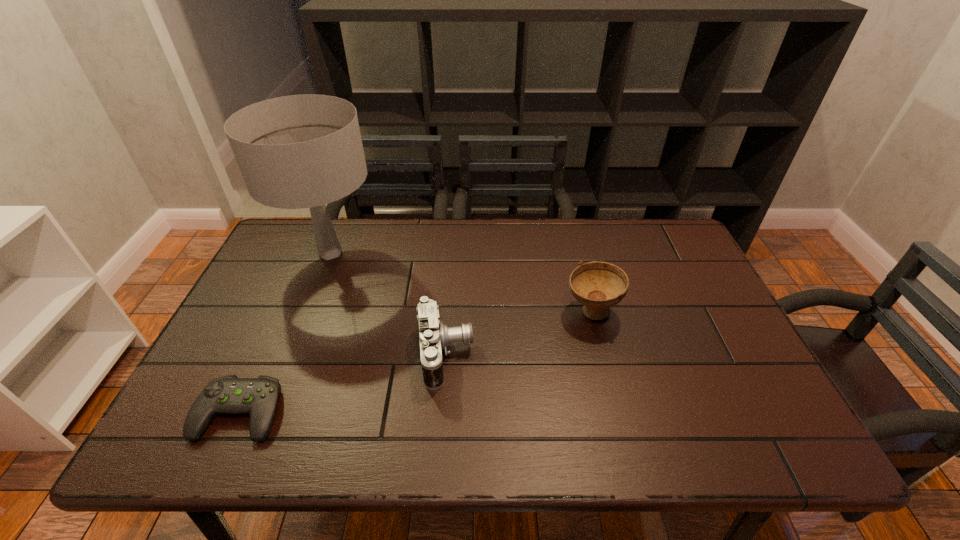
The width and height of the screenshot is (960, 540). I want to click on object situated at the far edge, so click(x=301, y=151).

Where is `object situated at the near edge`? object situated at the near edge is located at coordinates (258, 397).

Identify the location of lampshade that is at the left edge. This screenshot has height=540, width=960. (301, 151).

I want to click on control that is at the left edge, so click(258, 397).

You are a GUI agent. You are given a task and a screenshot of the screen. Output one action in this format:
    pyautogui.click(x=<x>, y=<y>)
    Task: Click on the object situated at the far left corner
    Image resolution: width=960 pixels, height=540 pixels.
    Given the screenshot: What is the action you would take?
    pyautogui.click(x=301, y=151)

The height and width of the screenshot is (540, 960). In order to click on object that is at the near left corner in this screenshot , I will do `click(258, 397)`.

This screenshot has height=540, width=960. I want to click on free region at the far edge, so click(492, 252).

Identify the location of vacant space at the near edge of the desktop. Image resolution: width=960 pixels, height=540 pixels. (375, 453).

This screenshot has width=960, height=540. I want to click on free spot at the left edge of the desktop, so click(x=261, y=335).

At what (x,y) coordinates should I click in order to perform the action: click on vacant position at the far left corner of the desktop. Please return your answer as a coordinate pair (x, y). Looking at the image, I should click on click(x=309, y=227).